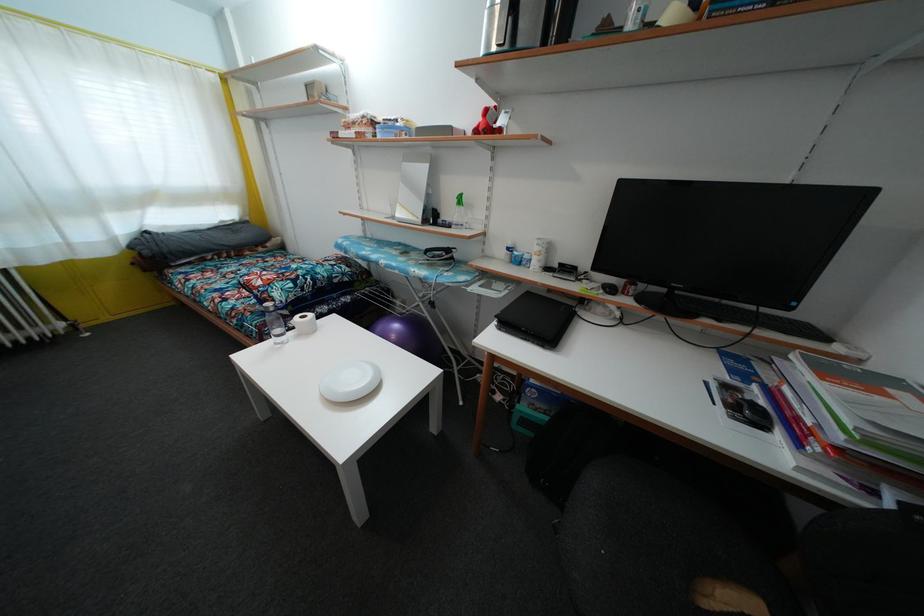
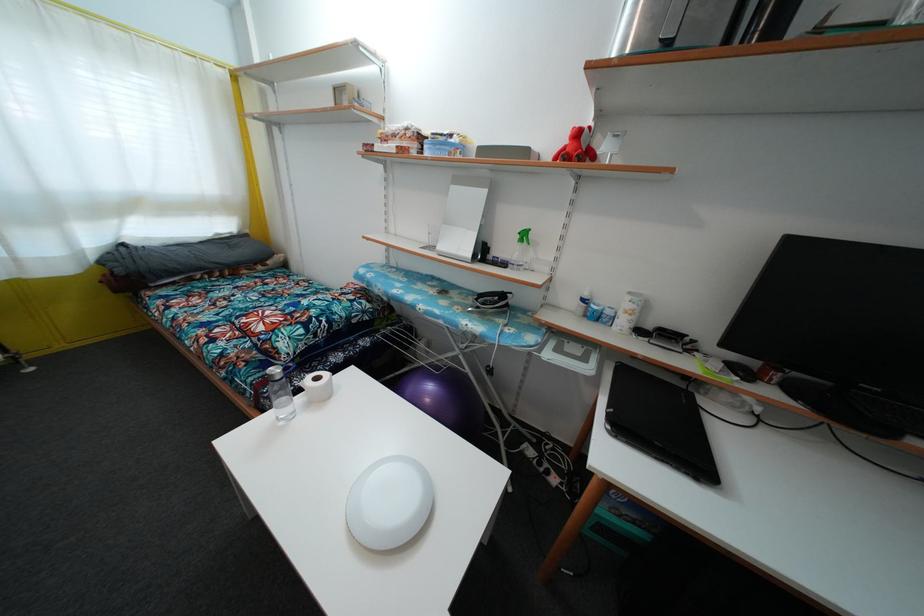
In a continuous first-person perspective shot, in which direction is the camera moving?

The movement direction of the cameraman is left, forward.